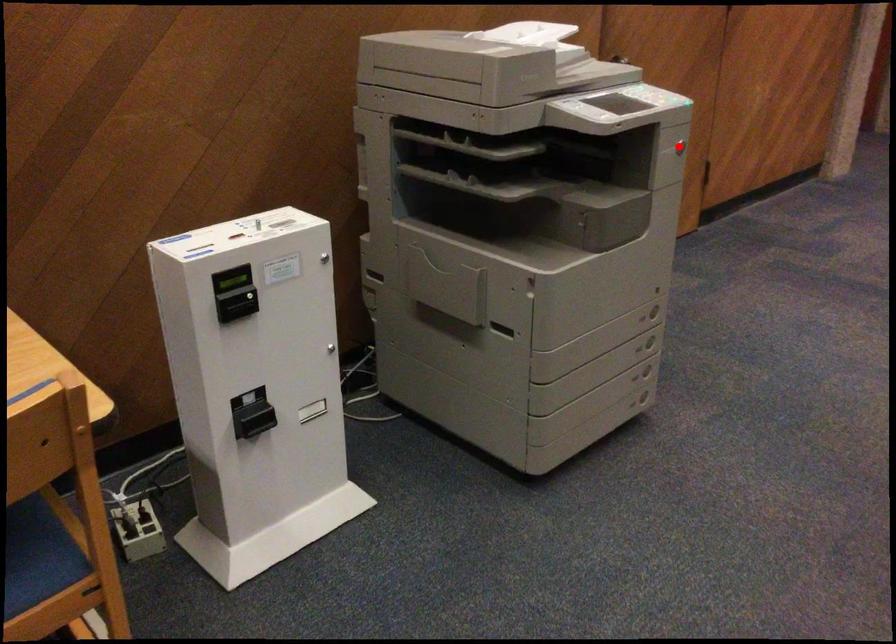
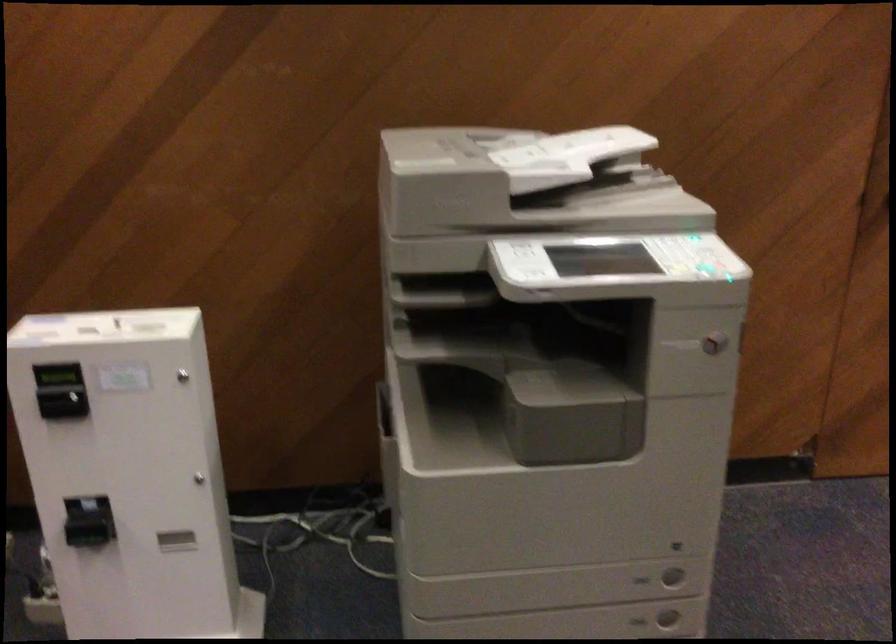
Find the pixel in the second image that matches the highlighted location in the first image.

(713, 343)